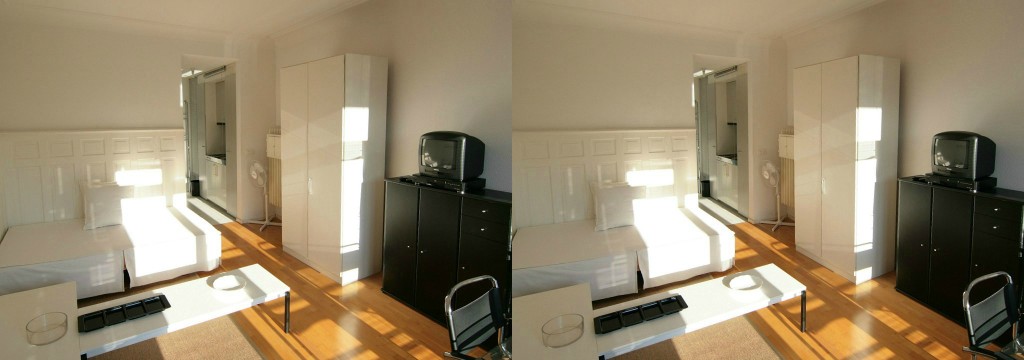
Locate an element on the screen. The image size is (1024, 360). table is located at coordinates (213, 301), (718, 306).